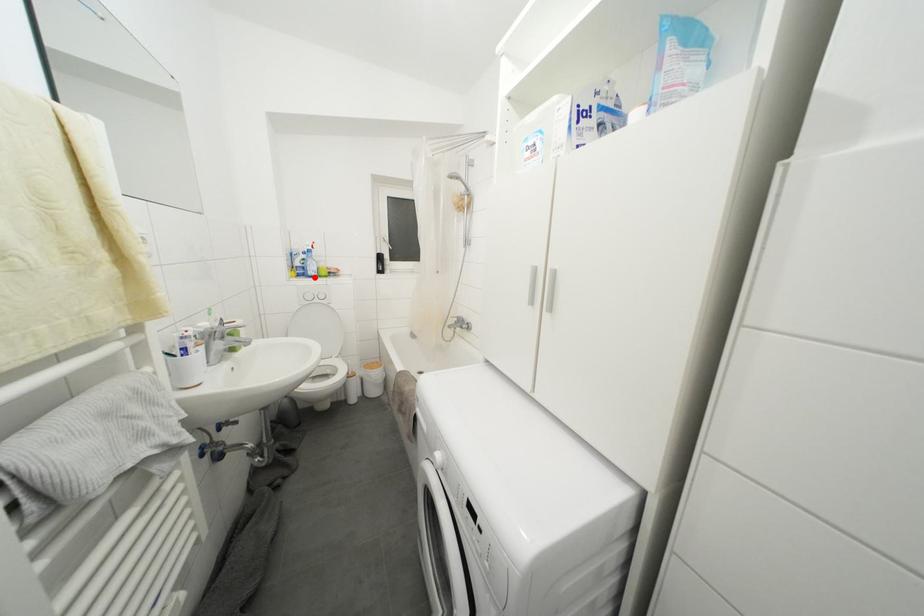
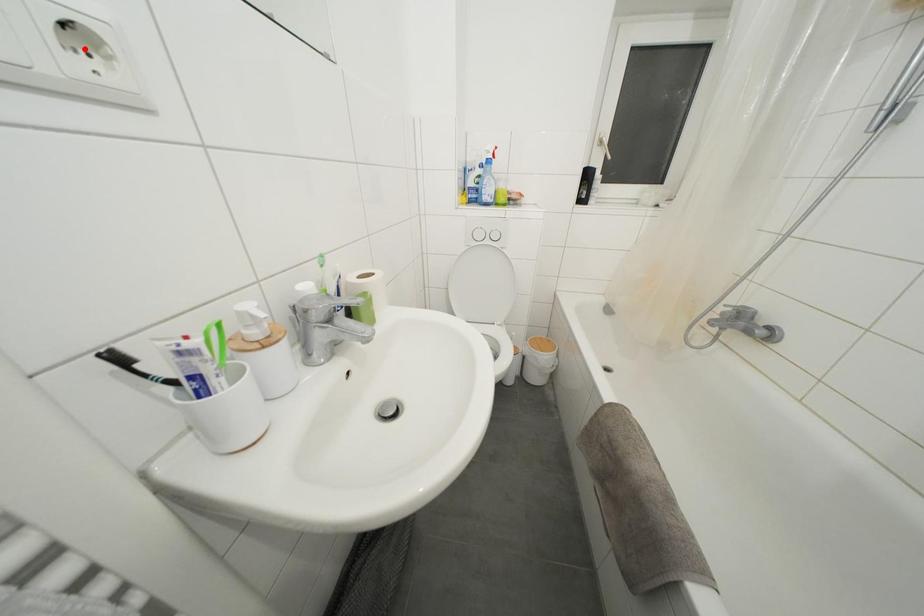
In the scene shown: I am providing you with two images of the same scene from different viewpoints. A red point is marked on the first image and another point is marked on the second image. Is the red point in image1 aligned with the point shown in image2?

No